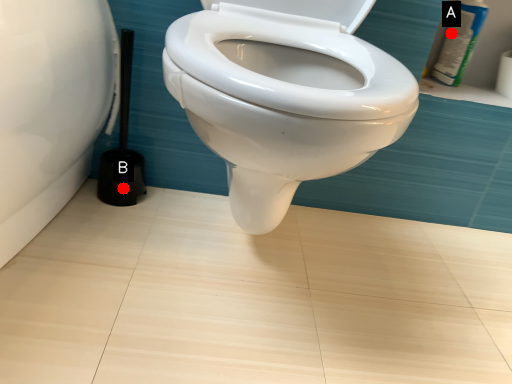
Question: Two points are circled on the image, labeled by A and B beside each circle. Which point is farther from the camera taking this photo?

Choices:
 (A) A is further
 (B) B is further

Answer: (A)